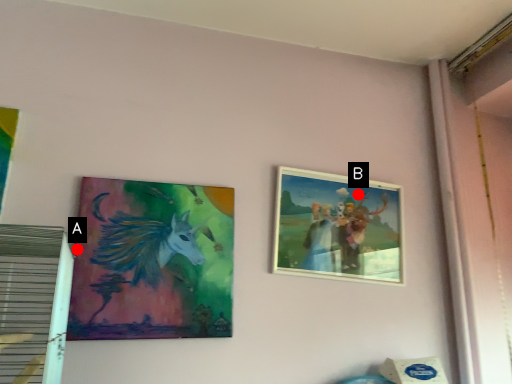
Question: Two points are circled on the image, labeled by A and B beside each circle. Which of the following is the closest to the observer?

Choices:
 (A) A is closer
 (B) B is closer

Answer: (A)